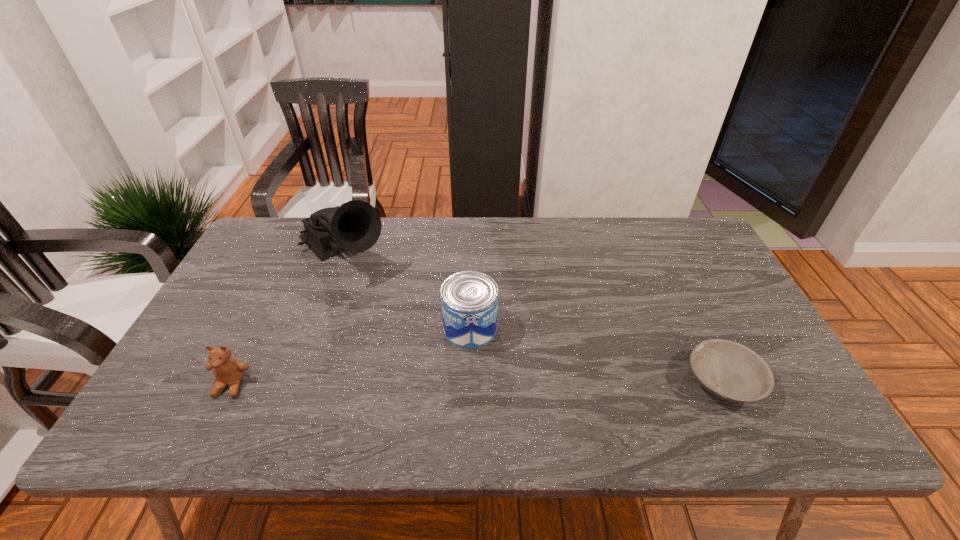
This screenshot has width=960, height=540. Find the location of `free space between the tallest object and the shortest object`. free space between the tallest object and the shortest object is located at coordinates (533, 316).

At what (x,y) coordinates should I click in order to perform the action: click on unoccupied position between the third nearest object and the farthest object. Please return your answer as a coordinate pair (x, y). Looking at the image, I should click on (407, 290).

Image resolution: width=960 pixels, height=540 pixels. I want to click on vacant space in between the bowl and the farthest object, so click(533, 316).

I want to click on free spot between the farthest object and the second tallest object, so click(407, 290).

Where is `free space between the bowl and the tallest object`? free space between the bowl and the tallest object is located at coordinates (533, 316).

Identify the location of free area in between the third nearest object and the second shortest object. (350, 356).

Where is `free space between the bowl and the can`? This screenshot has height=540, width=960. free space between the bowl and the can is located at coordinates (596, 355).

You are a GUI agent. You are given a task and a screenshot of the screen. Output one action in this format:
    pyautogui.click(x=<x>, y=<y>)
    Task: Click on the empty location between the can and the bowl
    The width and height of the screenshot is (960, 540).
    Given the screenshot: What is the action you would take?
    pyautogui.click(x=596, y=355)

Where is `free area in between the phonograph_record and the bowl`? This screenshot has height=540, width=960. free area in between the phonograph_record and the bowl is located at coordinates (533, 316).

Find the location of a particular element. This screenshot has width=960, height=540. free area in between the rightmost object and the teddy bear is located at coordinates (477, 383).